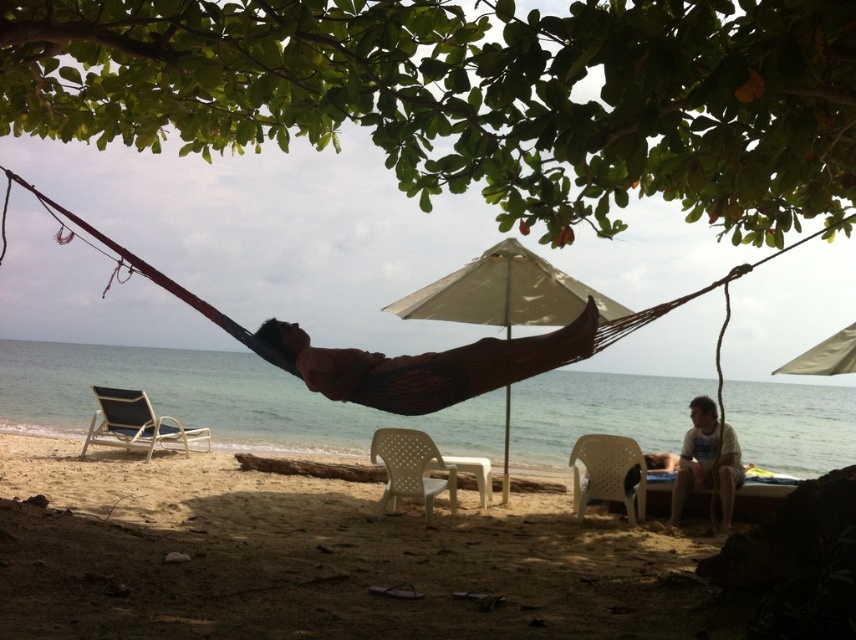
You are planning to set up a picnic spot on the beach. You see the white plastic chairs at lower center and the tan fabric umbrella at upper center. Which object is located to the left of the other?

The white plastic chairs at lower center are positioned on the left side of the tan fabric umbrella at upper center.

You are a photographer standing at the edge of the beach. You want to take a photo that includes both the white plastic chairs at lower center and the tan fabric umbrella at upper center. Which object should you position closer to the front of your photo frame?

The white plastic chairs at lower center should be positioned closer to the front of your photo frame since they are closer to the viewer than the tan fabric umbrella at upper center.

You need to choose a chair to read a book comfortably. Which one between the white plastic beach chair at left and the white plastic chair at center is bigger?

The white plastic beach chair at left is larger in size compared to the white plastic chair at center, so it would be more comfortable for reading.